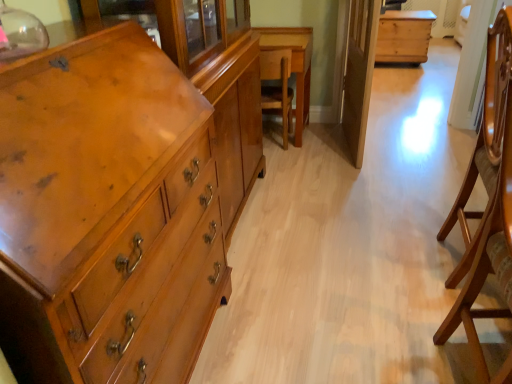
In order to face wooden chair at center, marked as the second armchair in a right-to-left arrangement, should I rotate leftwards or rightwards?

Rotate right and turn 2.261 degrees.

The height and width of the screenshot is (384, 512). Describe the element at coordinates (487, 205) in the screenshot. I see `wooden armchair at right, marked as the 2th armchair in a top-to-bottom arrangement` at that location.

Measure the distance between point (379, 40) and camera.

The depth of point (379, 40) is 4.14 meters.

Where is `wooden chair at center, the 1th armchair from the back`? wooden chair at center, the 1th armchair from the back is located at coordinates (277, 86).

From a real-world perspective, does wooden table at center, the first table from the front, sit lower than matte wood chest of drawers at left?

Correct, in the physical world, wooden table at center, the first table from the front, is lower than matte wood chest of drawers at left.

Which is behind, point (302, 29) or point (153, 175)?

Point (302, 29)

Based on the photo, are wooden table at center, which is counted as the 2th table, starting from the top, and matte wood chest of drawers at left far apart?

wooden table at center, which is counted as the 2th table, starting from the top, is far away from matte wood chest of drawers at left.

Based on the photo, between wooden table at center, which is the 2th table from right to left, and matte wood chest of drawers at left, which one has smaller width?

matte wood chest of drawers at left.

Which object is thinner, wooden armchair at right, positioned as the second armchair in left-to-right order, or wooden table at center, which is the 2th table from right to left?

wooden armchair at right, positioned as the second armchair in left-to-right order, is thinner.

What's the angular difference between wooden armchair at right, the 1th armchair ordered from the bottom, and wooden table at center, the first table from the front,'s facing directions?

91.4 degrees.

From a real-world perspective, is wooden armchair at right, positioned as the first armchair in right-to-left order, beneath wooden table at center, which is counted as the 2th table, starting from the top?

No, from a real-world perspective, wooden armchair at right, positioned as the first armchair in right-to-left order, is not under wooden table at center, which is counted as the 2th table, starting from the top.

Is wooden table at center, the 2th table in the back-to-front sequence, inside wooden armchair at right, marked as the 2th armchair in a top-to-bottom arrangement?

No, wooden table at center, the 2th table in the back-to-front sequence, is not a part of wooden armchair at right, marked as the 2th armchair in a top-to-bottom arrangement.

From the image's perspective, would you say wooden armchair at right, marked as the 2th armchair in a top-to-bottom arrangement, is shown under natural wood chest at center, which is counted as the 1th table, starting from the top?

Yes, from the image's perspective, wooden armchair at right, marked as the 2th armchair in a top-to-bottom arrangement, is below natural wood chest at center, which is counted as the 1th table, starting from the top.

Which of these two, wooden armchair at right, positioned as the second armchair in left-to-right order, or natural wood chest at center, which is counted as the 1th table, starting from the top, is thinner?

With smaller width is wooden armchair at right, positioned as the second armchair in left-to-right order.

Which object is positioned more to the left, wooden armchair at right, the first armchair viewed from the front, or natural wood chest at center, which is counted as the 1th table, starting from the top?

wooden armchair at right, the first armchair viewed from the front.

How different are the orientations of wooden armchair at right, the 1th armchair ordered from the bottom, and wooden chair at center, marked as the second armchair in a right-to-left arrangement, in degrees?

They differ by 91 degrees in their facing directions.

In the scene shown: Between wooden armchair at right, the 1th armchair ordered from the bottom, and wooden chair at center, marked as the second armchair in a right-to-left arrangement, which one has larger width?

wooden chair at center, marked as the second armchair in a right-to-left arrangement, is wider.

Are wooden armchair at right, the first armchair viewed from the front, and wooden chair at center, which appears as the 2th armchair when ordered from the bottom, far apart?

Yes, wooden armchair at right, the first armchair viewed from the front, and wooden chair at center, which appears as the 2th armchair when ordered from the bottom, are located far from each other.

Considering the relative sizes of wooden armchair at right, marked as the 2th armchair in a top-to-bottom arrangement, and wooden chair at center, the 1th armchair from the back, in the image provided, is wooden armchair at right, marked as the 2th armchair in a top-to-bottom arrangement, smaller than wooden chair at center, the 1th armchair from the back,?

No.

How many degrees apart are the facing directions of transparent glass door at center and wooden armchair at right, positioned as the first armchair in right-to-left order?

The angular difference between transparent glass door at center and wooden armchair at right, positioned as the first armchair in right-to-left order, is 8.61 degrees.

Where is `the 2nd armchair positioned below the transparent glass door at center (from the image's perspective)`? the 2nd armchair positioned below the transparent glass door at center (from the image's perspective) is located at coordinates (487, 205).

Is transparent glass door at center with wooden armchair at right, positioned as the second armchair in left-to-right order?

No, transparent glass door at center is not beside wooden armchair at right, positioned as the second armchair in left-to-right order.

Is transparent glass door at center oriented away from wooden armchair at right, marked as the 2th armchair in a top-to-bottom arrangement?

transparent glass door at center does not have its back to wooden armchair at right, marked as the 2th armchair in a top-to-bottom arrangement.

Does natural wood chest at center, which appears as the 1th table when viewed from the back, have a smaller size compared to matte wood chest of drawers at left?

Yes, natural wood chest at center, which appears as the 1th table when viewed from the back, is smaller than matte wood chest of drawers at left.

Can we say natural wood chest at center, which appears as the 1th table when viewed from the back, lies outside matte wood chest of drawers at left?

natural wood chest at center, which appears as the 1th table when viewed from the back, is positioned outside matte wood chest of drawers at left.

Could you tell me if natural wood chest at center, which is the 2th table in front-to-back order, is facing matte wood chest of drawers at left?

No, natural wood chest at center, which is the 2th table in front-to-back order, is not facing towards matte wood chest of drawers at left.

Is point (390, 23) behind point (135, 324)?

Yes, it is behind point (135, 324).

Considering the positions of objects wooden armchair at right, which is the second armchair in back-to-front order, and transparent glass door at center in the image provided, who is more to the left, wooden armchair at right, which is the second armchair in back-to-front order, or transparent glass door at center?

transparent glass door at center.

Which object is further away from the camera taking this photo, wooden armchair at right, marked as the 2th armchair in a top-to-bottom arrangement, or transparent glass door at center?

transparent glass door at center is more distant.

Is wooden armchair at right, positioned as the first armchair in right-to-left order, smaller than transparent glass door at center?

Actually, wooden armchair at right, positioned as the first armchair in right-to-left order, might be larger than transparent glass door at center.

From the image's perspective, count 1st tables upward from the matte wood chest of drawers at left and point to it. Please provide its 2D coordinates.

[(294, 65)]

The width and height of the screenshot is (512, 384). I want to click on the 2nd armchair positioned below the wooden table at center, the 2th table in the back-to-front sequence (from the image's perspective), so click(x=487, y=205).

Which object lies further to the anchor point transparent glass door at center, matte wood chest of drawers at left or wooden chair at center, which appears as the 2th armchair when ordered from the bottom?

matte wood chest of drawers at left is positioned further to the anchor transparent glass door at center.

From the image, which object appears to be farther from matte wood chest of drawers at left, wooden table at center, arranged as the 1th table when viewed from the left, or wooden armchair at right, marked as the 2th armchair in a top-to-bottom arrangement?

Based on the image, wooden table at center, arranged as the 1th table when viewed from the left, appears to be further to matte wood chest of drawers at left.

Based on their spatial positions, is wooden armchair at right, the 1th armchair ordered from the bottom, or matte wood chest of drawers at left closer to natural wood chest at center, the second table positioned from the bottom?

wooden armchair at right, the 1th armchair ordered from the bottom, is closer to natural wood chest at center, the second table positioned from the bottom.

Looking at the image, which one is located further to wooden table at center, the first table from the front, natural wood chest at center, which is counted as the second table, starting from the left, or matte wood chest of drawers at left?

natural wood chest at center, which is counted as the second table, starting from the left, lies further to wooden table at center, the first table from the front, than the other object.

Based on their spatial positions, is natural wood chest at center, which is counted as the second table, starting from the left, or wooden chair at center, which is the 1th armchair in left-to-right order, further from matte wood chest of drawers at left?

natural wood chest at center, which is counted as the second table, starting from the left, is further to matte wood chest of drawers at left.

Looking at the image, which one is located closer to natural wood chest at center, which is the 1th table from right to left, matte wood chest of drawers at left or transparent glass door at center?

transparent glass door at center is closer to natural wood chest at center, which is the 1th table from right to left.

Based on their spatial positions, is wooden armchair at right, positioned as the first armchair in right-to-left order, or transparent glass door at center further from wooden table at center, arranged as the 1th table when viewed from the left?

wooden armchair at right, positioned as the first armchair in right-to-left order, lies further to wooden table at center, arranged as the 1th table when viewed from the left, than the other object.

When comparing their distances from matte wood chest of drawers at left, does wooden armchair at right, the first armchair viewed from the front, or wooden chair at center, marked as the second armchair in a right-to-left arrangement, seem further?

wooden chair at center, marked as the second armchair in a right-to-left arrangement, lies further to matte wood chest of drawers at left than the other object.

This screenshot has height=384, width=512. I want to click on glass door located between matte wood chest of drawers at left and wooden chair at center, marked as the second armchair in a right-to-left arrangement, in the depth direction, so click(359, 74).

This screenshot has width=512, height=384. What are the coordinates of `glass door between matte wood chest of drawers at left and wooden table at center, arranged as the 1th table when viewed from the left, from front to back` in the screenshot? It's located at (359, 74).

Image resolution: width=512 pixels, height=384 pixels. In order to click on table between matte wood chest of drawers at left and natural wood chest at center, the second table positioned from the bottom, along the z-axis in this screenshot , I will do `click(294, 65)`.

This screenshot has width=512, height=384. In order to click on armchair between wooden armchair at right, positioned as the second armchair in left-to-right order, and wooden table at center, which is counted as the 2th table, starting from the top, in the front-back direction in this screenshot , I will do `click(277, 86)`.